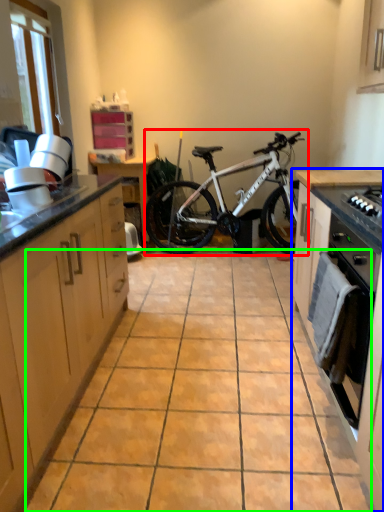
Question: Considering the real-world distances, which object is closest to bicycle (highlighted by a red box)? cabinetry (highlighted by a blue box) or ceramic tile (highlighted by a green box).

Choices:
 (A) cabinetry
 (B) ceramic tile

Answer: (A)